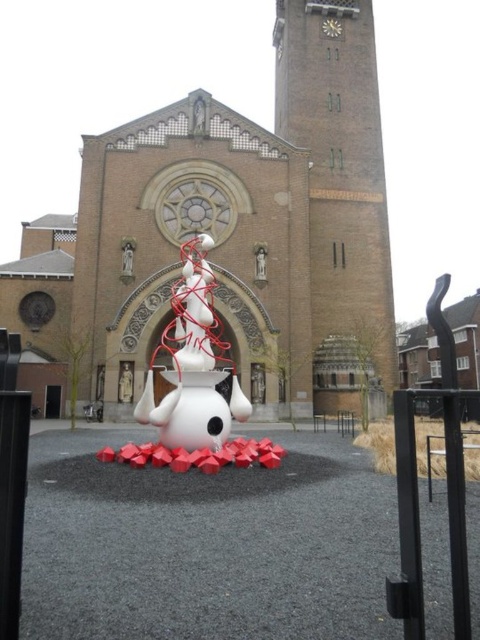
Question: Does brown brick church at center appear over white glossy snowman at center?

Choices:
 (A) yes
 (B) no

Answer: (A)

Question: Which point is farther to the camera?

Choices:
 (A) brown brick church at center
 (B) white glossy snowman at center
 (C) brick clock tower at upper center

Answer: (C)

Question: Considering the real-world distances, which object is closest to the white glossy snowman at center?

Choices:
 (A) metallic clock at upper center
 (B) brown brick church at center

Answer: (B)

Question: Does brown brick church at center appear over metallic clock at upper center?

Choices:
 (A) no
 (B) yes

Answer: (A)

Question: Can you confirm if brown brick church at center is smaller than metallic clock at upper center?

Choices:
 (A) yes
 (B) no

Answer: (B)

Question: Which point is closer to the camera?

Choices:
 (A) (374, 147)
 (B) (276, 45)

Answer: (A)